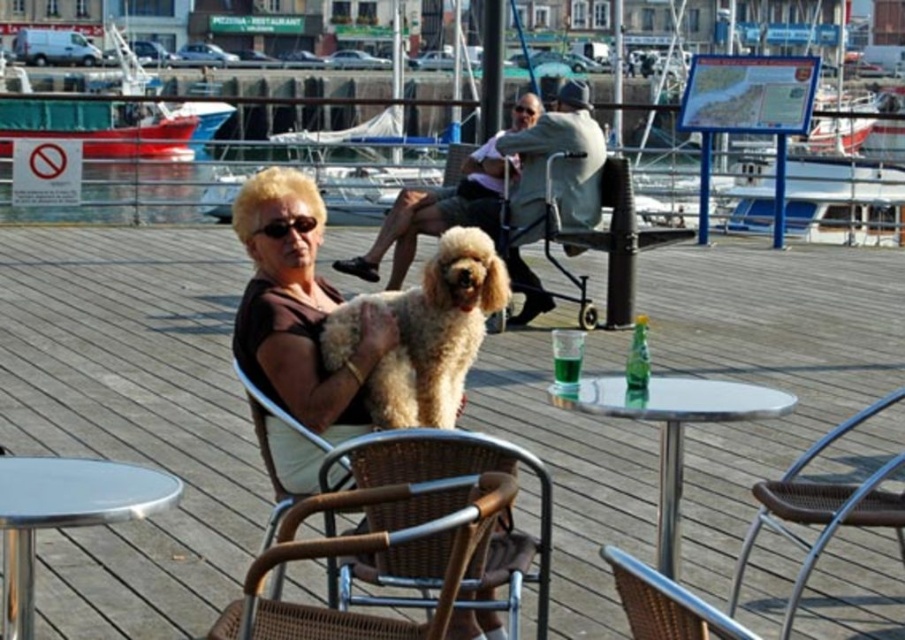
Question: Does brown wicker chair at center have a larger size compared to green glass bottle at lower right?

Choices:
 (A) no
 (B) yes

Answer: (B)

Question: Can you confirm if brown wicker chair at center is positioned to the right of shiny metallic table at center?

Choices:
 (A) yes
 (B) no

Answer: (B)

Question: Which point is closer to the camera?

Choices:
 (A) (302, 420)
 (B) (684, 387)
 (C) (331, 336)
 (D) (649, 620)

Answer: (D)

Question: Can you confirm if brown wicker chair at center is positioned to the right of polished stainless steel table at lower left?

Choices:
 (A) no
 (B) yes

Answer: (B)

Question: Based on their relative distances, which object is nearer to the woven wicker chair at center?

Choices:
 (A) light brown fabric chair at center
 (B) brown wicker chair at center
 (C) shiny metallic table at center
 (D) green glass bottle at lower right

Answer: (B)

Question: Among these objects, which one is farthest from the camera?

Choices:
 (A) brown wicker chair at center
 (B) polished stainless steel table at lower left
 (C) light brown fabric chair at center

Answer: (C)